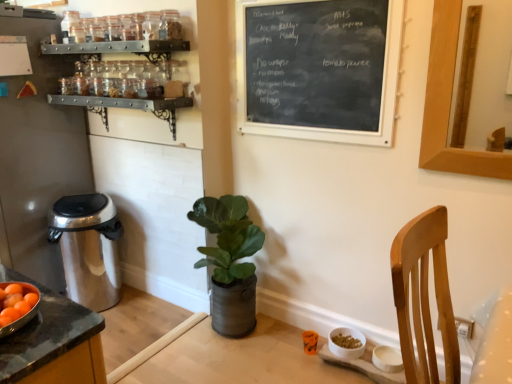
The image size is (512, 384). I want to click on free location to the left of green leafy plant in metallic pot at center, so click(167, 331).